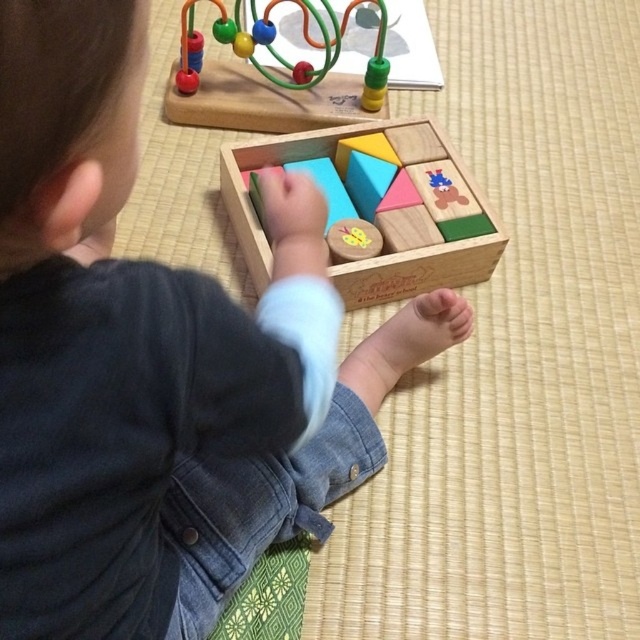
From the picture: You are helping organize a playroom. You have a denim jacket at lower center and a wooden bead maze at upper center. Which object takes up more horizontal space?

Answer: The wooden bead maze at upper center takes up more horizontal space because the denim jacket at lower center has a lesser width compared to it.

You are a parent looking at the play area. You need to place a new toy between the denim jacket at lower center and the wooden bead maze at upper center. Based on their positions, where should you place the new toy?

The denim jacket at lower center is located below the wooden bead maze at upper center, so you should place the new toy in between them vertically, positioning it between the lower and upper areas of the play space.

You are a parent observing your child playing with the wooden bead maze at upper center and the wooden block set at center. Which toy is positioned higher in the image?

The wooden bead maze at upper center is located above the wooden block set at center, so it is positioned higher in the image.